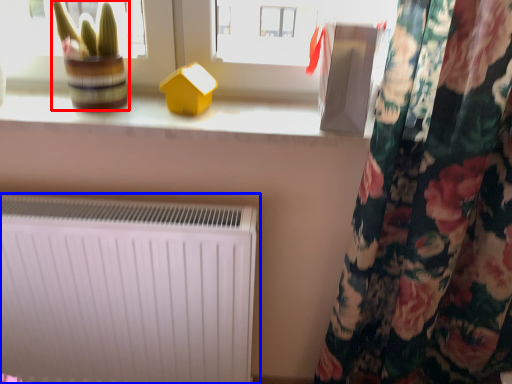
Question: Which object is further to the camera taking this photo, plant (highlighted by a red box) or radiator (highlighted by a blue box)?

Choices:
 (A) plant
 (B) radiator

Answer: (B)